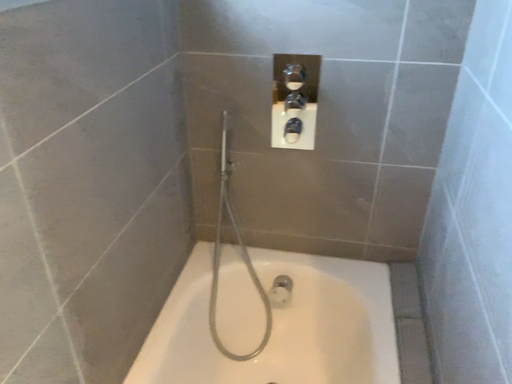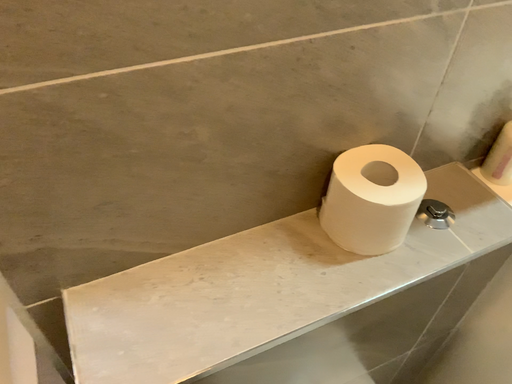
Question: Which way did the camera rotate in the video?

Choices:
 (A) rotated left
 (B) rotated right

Answer: (B)